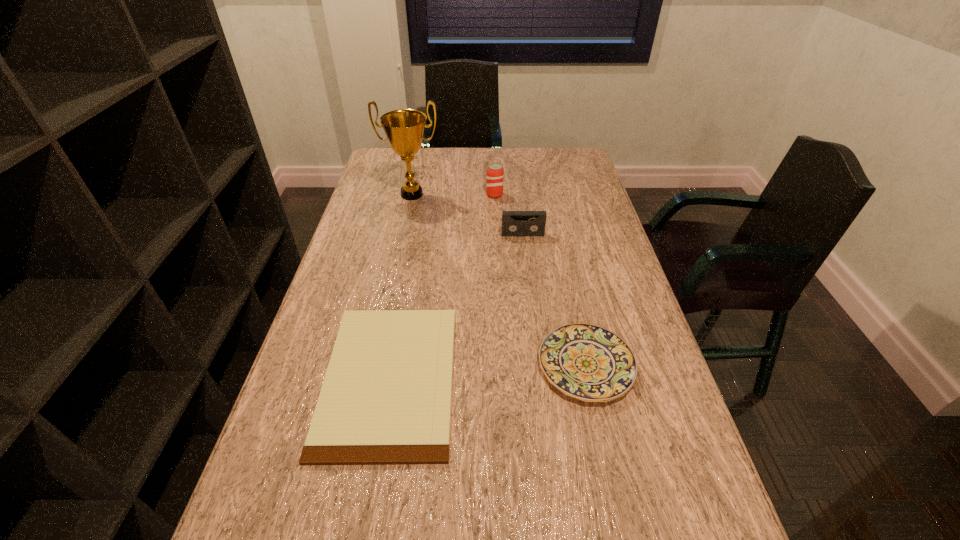
You are a GUI agent. You are given a task and a screenshot of the screen. Output one action in this format:
    pyautogui.click(x=<x>, y=<y>)
    Task: Click on the vacant space that's between the fourth tallest object and the shortest object
    
    Given the screenshot: What is the action you would take?
    pyautogui.click(x=488, y=372)

Locate an element on the screen. Image resolution: width=960 pixels, height=540 pixels. empty location between the award and the fourth tallest object is located at coordinates (499, 280).

At what (x,y) coordinates should I click in order to perform the action: click on vacant area that lies between the second shortest object and the fourth shortest object. Please return your answer as a coordinate pair (x, y). The image size is (960, 540). Looking at the image, I should click on (540, 280).

You are a GUI agent. You are given a task and a screenshot of the screen. Output one action in this format:
    pyautogui.click(x=<x>, y=<y>)
    Task: Click on the free point between the third nearest object and the award
    The height and width of the screenshot is (540, 960).
    Given the screenshot: What is the action you would take?
    pyautogui.click(x=468, y=214)

Locate an element on the screen. The width and height of the screenshot is (960, 540). free space between the fourth tallest object and the second tallest object is located at coordinates (540, 280).

The width and height of the screenshot is (960, 540). Find the location of `empty space between the second tallest object and the plate`. empty space between the second tallest object and the plate is located at coordinates (540, 280).

Image resolution: width=960 pixels, height=540 pixels. I want to click on the second closest object to the fourth tallest object, so click(514, 223).

Locate which object is the closest to the third nearest object. Please provide its 2D coordinates. Your answer should be formatted as a tuple, i.e. [(x, y)], where the tuple contains the x and y coordinates of a point satisfying the conditions above.

[(495, 173)]

Where is `free space that satisfies the following two spatial constraints: 1. on the front-facing side of the plate; 2. on the right side of the videotape`? This screenshot has width=960, height=540. free space that satisfies the following two spatial constraints: 1. on the front-facing side of the plate; 2. on the right side of the videotape is located at coordinates (539, 366).

You are a GUI agent. You are given a task and a screenshot of the screen. Output one action in this format:
    pyautogui.click(x=<x>, y=<y>)
    Task: Click on the free space that satisfies the following two spatial constraints: 1. on the front view with handles of the fourth tallest object; 2. on the left side of the award
    This screenshot has height=540, width=960.
    Given the screenshot: What is the action you would take?
    pyautogui.click(x=375, y=366)